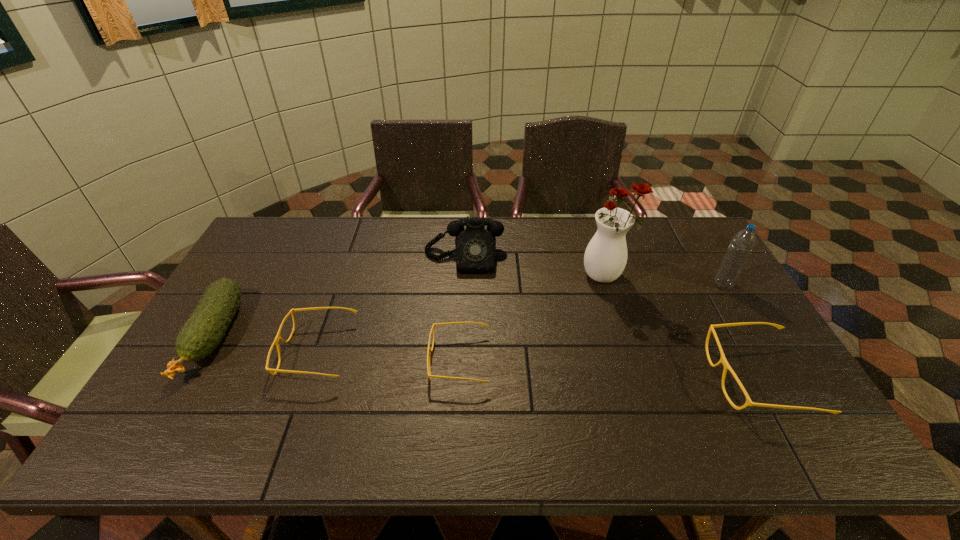
Image resolution: width=960 pixels, height=540 pixels. In order to click on the second tallest spectacles in this screenshot , I will do `click(278, 336)`.

Find the location of a particular element. The image size is (960, 540). the sixth tallest object is located at coordinates (278, 336).

Identify the location of the shortest object. click(429, 350).

The image size is (960, 540). I want to click on the second spectacles from left to right, so (429, 350).

Find the location of a particular element. Image resolution: width=960 pixels, height=540 pixels. the rightmost spectacles is located at coordinates (722, 360).

Locate an element on the screen. The width and height of the screenshot is (960, 540). the third tallest object is located at coordinates (475, 247).

The width and height of the screenshot is (960, 540). What are the coordinates of `vase` in the screenshot? It's located at (605, 258).

This screenshot has width=960, height=540. Identify the location of the third object from right to left. (605, 258).

Locate an element on the screen. the fourth tallest object is located at coordinates (203, 331).

Identify the location of cucumber. The image size is (960, 540). (203, 331).